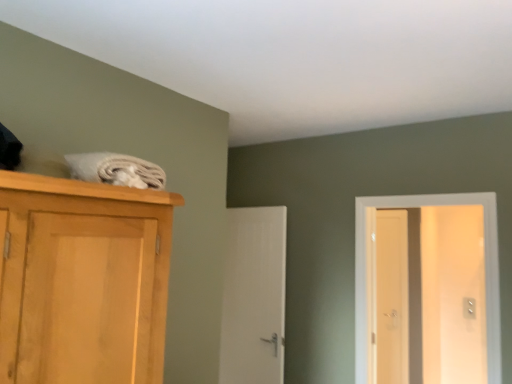
Question: From a real-world perspective, is light brown wooden screen door at right positioned above or below white smooth door at center, which is the 1th door in back-to-front order?

Choices:
 (A) above
 (B) below

Answer: (B)

Question: From the image's perspective, is light brown wooden screen door at right located above or below white smooth door at center, which is the 1th door in back-to-front order?

Choices:
 (A) above
 (B) below

Answer: (B)

Question: Estimate the real-world distances between objects in this image. Which object is closer to the light brown wooden screen door at right?

Choices:
 (A) white glossy door at right, which ranks as the 1th door in right-to-left order
 (B) white smooth door at center, which is counted as the first door, starting from the left

Answer: (A)

Question: Estimate the real-world distances between objects in this image. Which object is farther from the white smooth door at center, marked as the second door in a right-to-left arrangement?

Choices:
 (A) light brown wooden screen door at right
 (B) white glossy door at right, the first door from the front

Answer: (A)